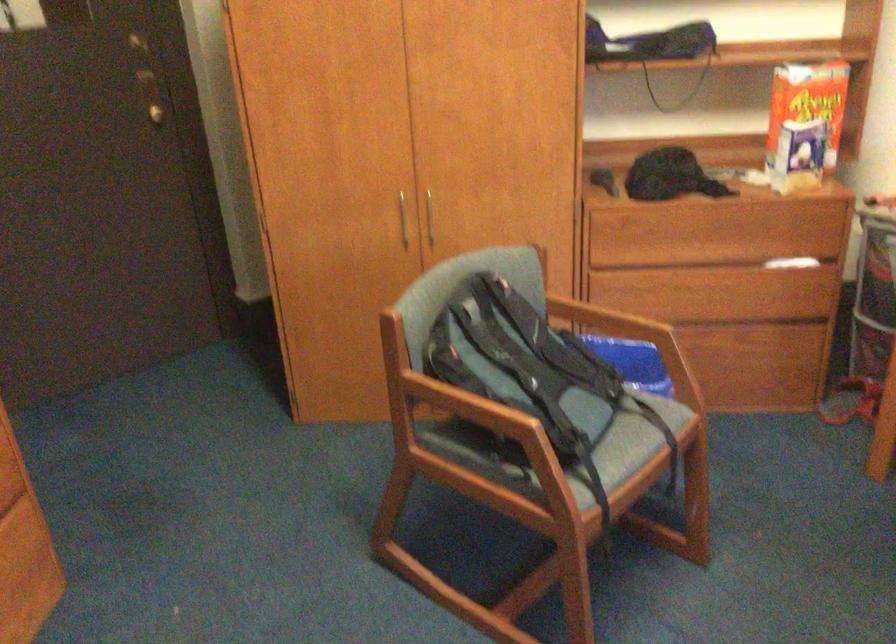
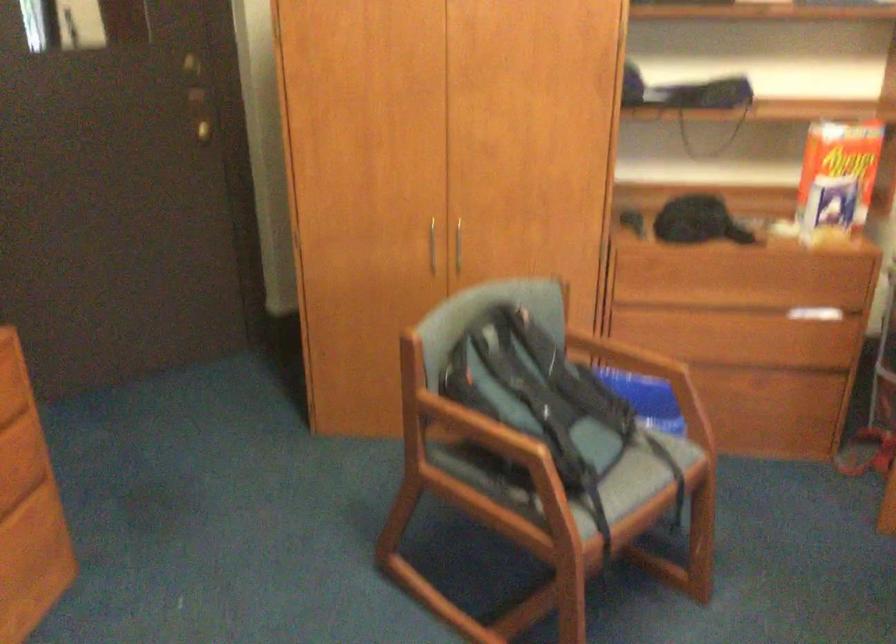
Question: Which direction would the cameraman need to move to produce the second image? Reply with the corresponding letter.

Choices:
 (A) Left
 (B) Right
 (C) Forward
 (D) Backward

Answer: (D)